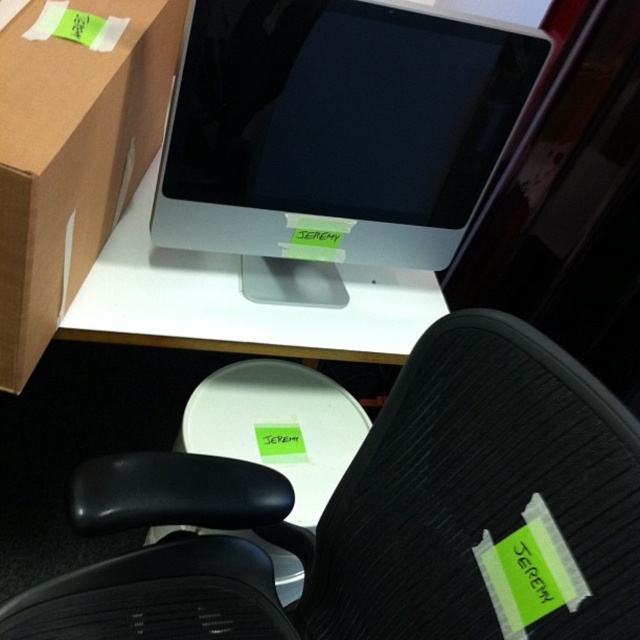
Does sleek silver monitor at upper center have a lesser width compared to brown cardboard box at upper left?

Incorrect, sleek silver monitor at upper center's width is not less than brown cardboard box at upper left's.

What do you see at coordinates (333, 136) in the screenshot? Image resolution: width=640 pixels, height=640 pixels. I see `sleek silver monitor at upper center` at bounding box center [333, 136].

Does point (150, 240) come in front of point (0, 112)?

No, it is not.

Locate an element on the screen. This screenshot has height=640, width=640. sleek silver monitor at upper center is located at coordinates (333, 136).

Is black mesh swivel chair at center taller than white glossy table at center?

Correct, black mesh swivel chair at center is much taller as white glossy table at center.

Image resolution: width=640 pixels, height=640 pixels. I want to click on black mesh swivel chair at center, so click(x=378, y=515).

I want to click on black mesh swivel chair at center, so click(378, 515).

Between brown cardboard box at upper left and white glossy table at center, which one has more height?

With more height is brown cardboard box at upper left.

Is point (68, 305) positioned after point (56, 332)?

Yes, point (68, 305) is farther from viewer.

You are a GUI agent. You are given a task and a screenshot of the screen. Output one action in this format:
    pyautogui.click(x=<x>, y=<y>)
    Task: Click on the brown cardboard box at upper left
    The image size is (640, 640).
    Given the screenshot: What is the action you would take?
    pyautogui.click(x=72, y=157)